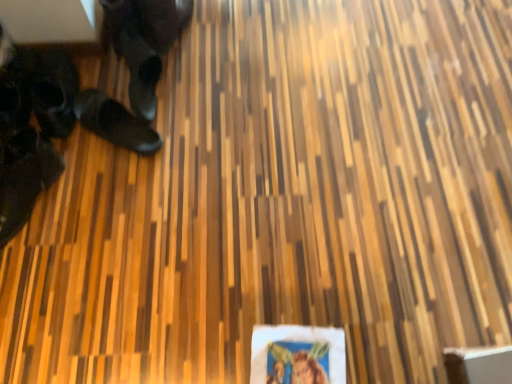
Question: From a real-world perspective, is black leather shoe at lower left, placed as the 1th footwear when sorted from left to right, on top of black rubber shoes at left, placed as the third footwear when sorted from left to right?

Choices:
 (A) yes
 (B) no

Answer: (B)

Question: From the image's perspective, is black leather shoe at lower left, the 3th footwear when ordered from right to left, on black rubber shoes at left, acting as the first footwear starting from the right?

Choices:
 (A) no
 (B) yes

Answer: (A)

Question: Can you confirm if black leather shoe at lower left, placed as the 1th footwear when sorted from left to right, is shorter than black rubber shoes at left, placed as the third footwear when sorted from left to right?

Choices:
 (A) yes
 (B) no

Answer: (B)

Question: Can you confirm if black leather shoe at lower left, placed as the 1th footwear when sorted from left to right, is positioned to the right of black rubber shoes at left, placed as the third footwear when sorted from left to right?

Choices:
 (A) yes
 (B) no

Answer: (B)

Question: Is black leather shoe at lower left, the 3th footwear when ordered from right to left, far away from black rubber shoes at left, placed as the third footwear when sorted from left to right?

Choices:
 (A) no
 (B) yes

Answer: (A)

Question: Could black rubber shoes at left, acting as the first footwear starting from the right, be considered to be inside black leather shoe at lower left, placed as the 1th footwear when sorted from left to right?

Choices:
 (A) yes
 (B) no

Answer: (B)

Question: Is black rubber shoes at left, placed as the third footwear when sorted from left to right, further to camera compared to black leather shoe at lower left, placed as the 1th footwear when sorted from left to right?

Choices:
 (A) yes
 (B) no

Answer: (A)

Question: Can you confirm if black rubber shoes at left, placed as the third footwear when sorted from left to right, is taller than black leather shoe at lower left, placed as the 1th footwear when sorted from left to right?

Choices:
 (A) yes
 (B) no

Answer: (B)

Question: Is the depth of black rubber shoes at left, acting as the first footwear starting from the right, less than that of black leather shoe at lower left, the 3th footwear when ordered from right to left?

Choices:
 (A) yes
 (B) no

Answer: (B)

Question: Considering the relative positions of black rubber shoes at left, acting as the first footwear starting from the right, and black leather shoe at lower left, placed as the 1th footwear when sorted from left to right, in the image provided, is black rubber shoes at left, acting as the first footwear starting from the right, to the left of black leather shoe at lower left, placed as the 1th footwear when sorted from left to right, from the viewer's perspective?

Choices:
 (A) no
 (B) yes

Answer: (A)

Question: Does black rubber shoes at left, placed as the third footwear when sorted from left to right, have a smaller size compared to black leather shoe at lower left, the 3th footwear when ordered from right to left?

Choices:
 (A) no
 (B) yes

Answer: (B)

Question: Can you confirm if black rubber shoes at left, placed as the third footwear when sorted from left to right, is shorter than black leather shoe at lower left, placed as the 1th footwear when sorted from left to right?

Choices:
 (A) yes
 (B) no

Answer: (A)

Question: Is black rubber shoes at left, placed as the third footwear when sorted from left to right, shorter than black leather shoes at left, which appears as the 2th footwear when viewed from the left?

Choices:
 (A) yes
 (B) no

Answer: (A)